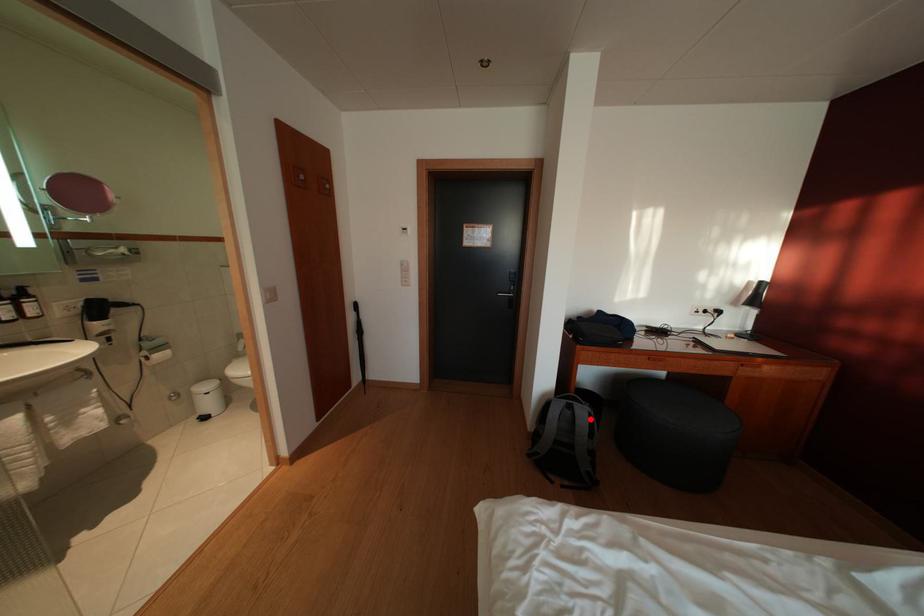
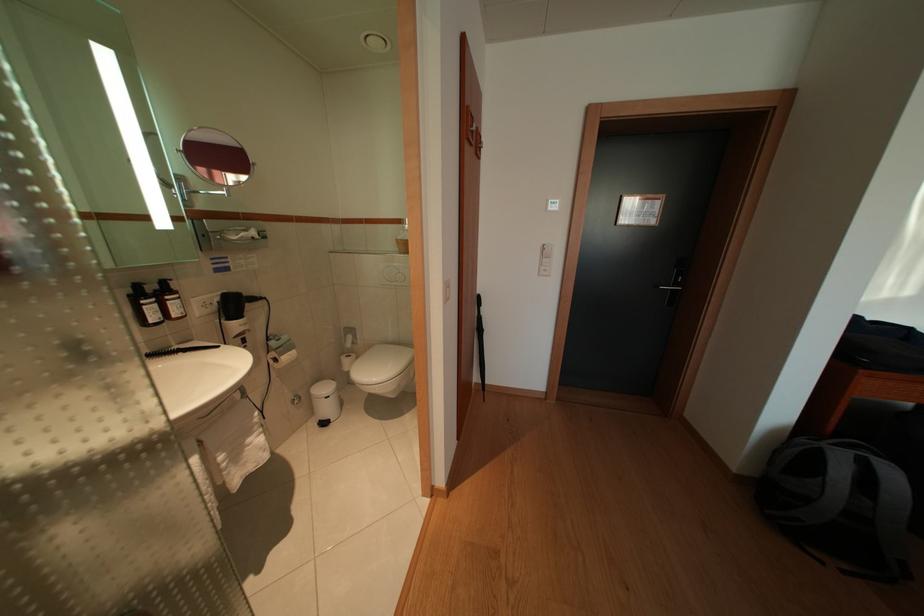
Locate, in the second image, the point that corresponds to the highlighted location in the first image.

(901, 480)